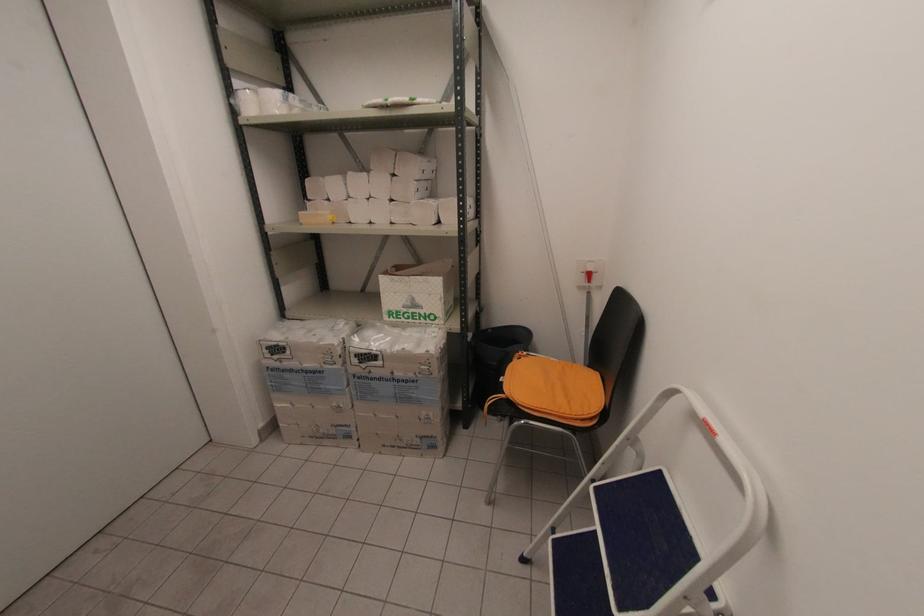
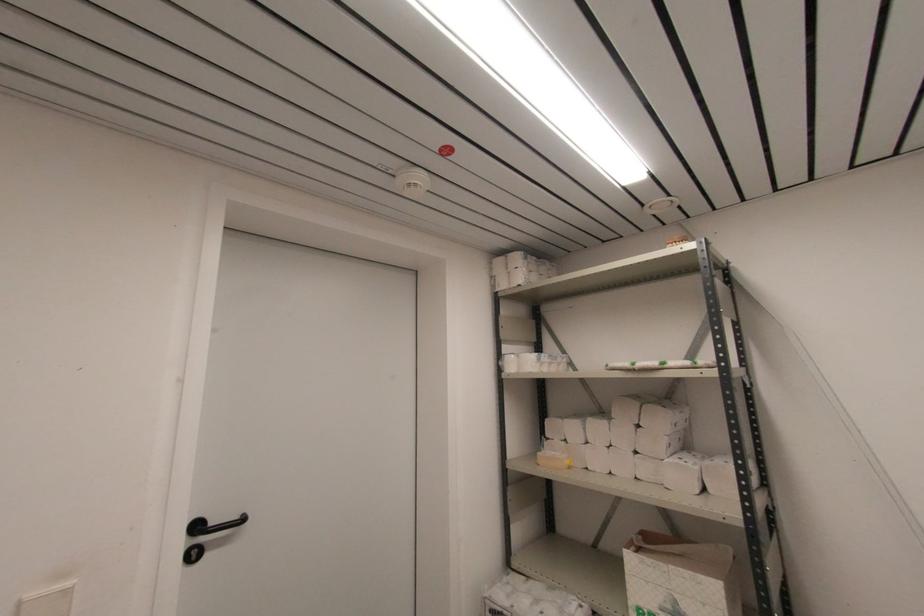
Locate, in the second image, the point that corresponds to point 410,304 in the first image.

(671, 609)